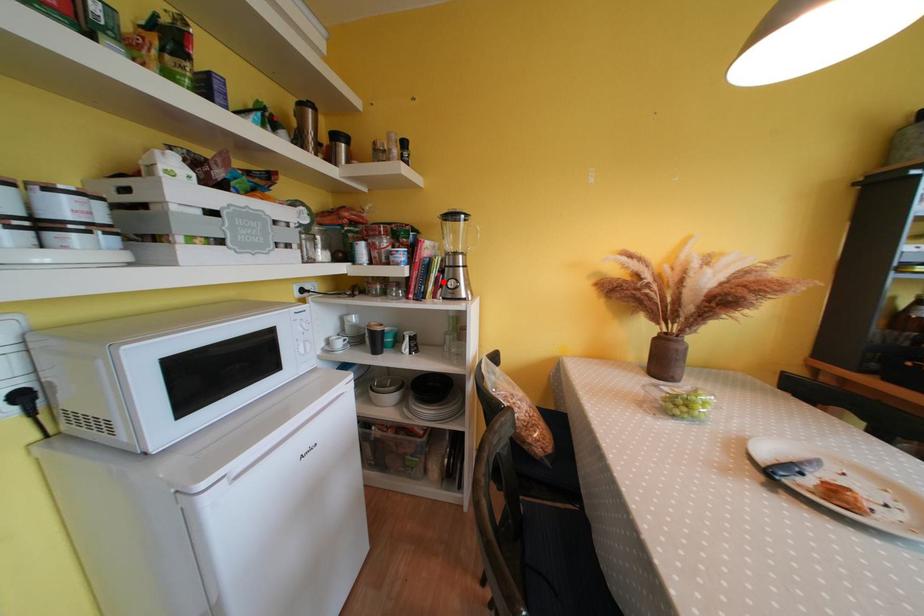
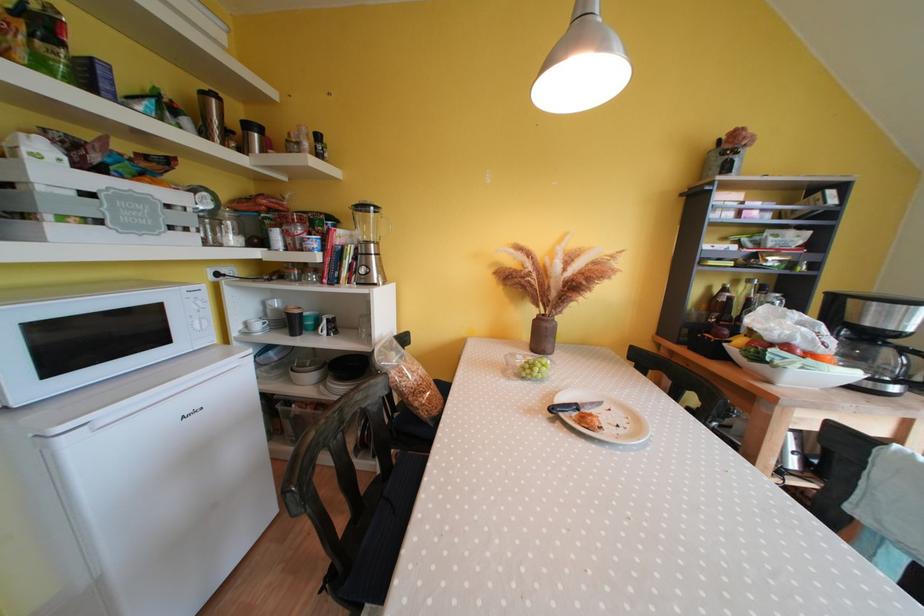
Locate, in the second image, the point that corresponds to the highlighted location in the first image.

(357, 269)